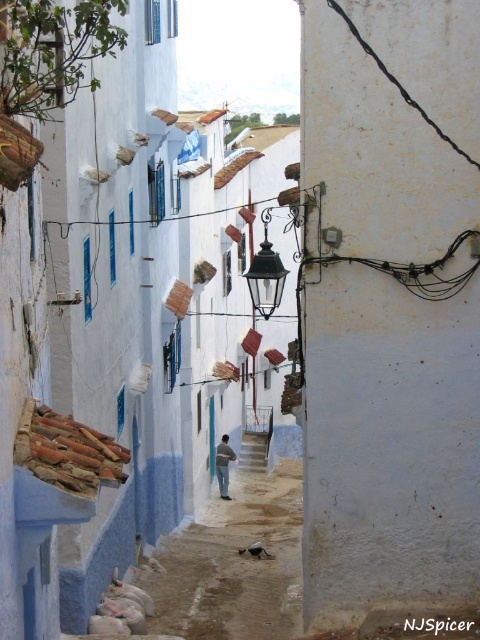
The width and height of the screenshot is (480, 640). What do you see at coordinates (252, 452) in the screenshot?
I see `smooth concrete stairs at center` at bounding box center [252, 452].

Image resolution: width=480 pixels, height=640 pixels. Find the location of `smooth concrete stairs at center`. smooth concrete stairs at center is located at coordinates (252, 452).

Does point (247, 436) come farther from viewer compared to point (227, 435)?

Yes, it is.

Locate an element on the screen. smooth concrete stairs at center is located at coordinates (252, 452).

Is point (272, 252) closer to camera compared to point (226, 444)?

Yes, point (272, 252) is in front of point (226, 444).

Can you confirm if black glass lantern at center is positioned to the right of blue fabric man at center?

Indeed, black glass lantern at center is positioned on the right side of blue fabric man at center.

Which is in front, point (277, 269) or point (223, 442)?

Point (277, 269)

The width and height of the screenshot is (480, 640). Identify the location of black glass lantern at center. (265, 275).

Can you confirm if black glass lantern at center is positioned to the right of smooth concrete stairs at center?

Yes, black glass lantern at center is to the right of smooth concrete stairs at center.

Which of these two, black glass lantern at center or smooth concrete stairs at center, stands taller?

black glass lantern at center is taller.

Is point (276, 296) farther from viewer compared to point (243, 445)?

No, (276, 296) is closer to viewer.

Locate an element on the screen. black glass lantern at center is located at coordinates (265, 275).